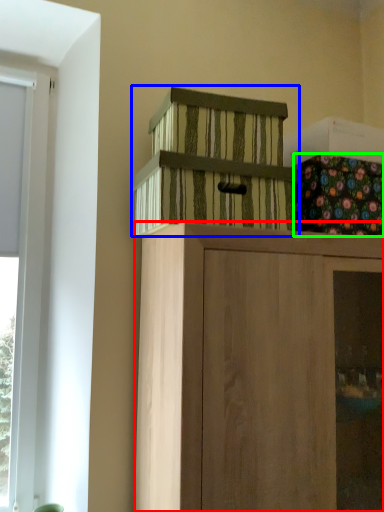
Question: Considering the real-world distances, which object is farthest from cabinetry (highlighted by a red box)? cabinetry (highlighted by a blue box) or flower (highlighted by a green box)?

Choices:
 (A) cabinetry
 (B) flower

Answer: (B)